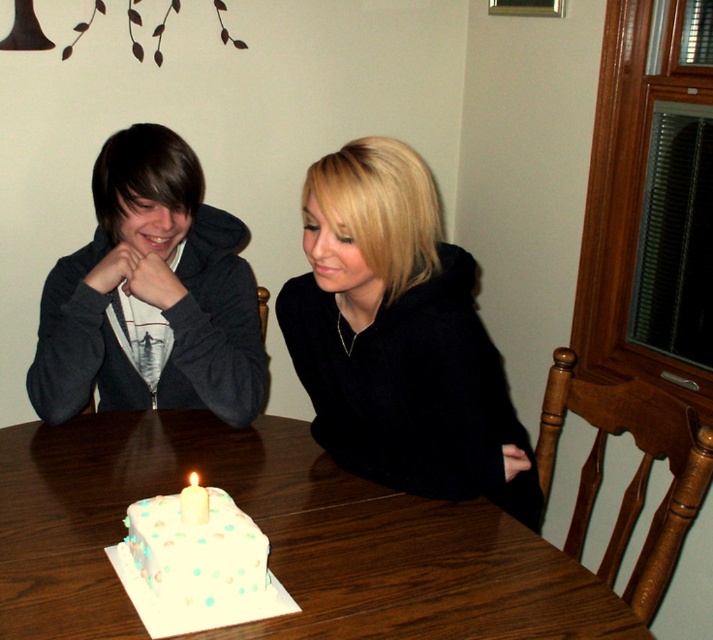
You are standing 1.0 meters away from the dining table. There is a point at coordinates point (31, 602). Can you reach that point without moving your feet?

The distance of point (31, 602) from viewer is 1.07 meters, so you are 0.07 meters too far to reach it without moving your feet.

You are a guest at a birthday celebration and see the white wooden table at center and the white wax candle at center. Which object is positioned higher relative to the other?

The white wax candle at center is positioned higher than the white wooden table at center because it is placed on top of the table.

You are planning to place a rectangular cake on the white wooden table at center. The cake is 1 meter long. Can the cake fit on the table if the black fuzzy sweater at center is already occupying half of the table?

The white wooden table at center is wider than the black fuzzy sweater at center, so the table has enough space to accommodate the cake even if the sweater is occupying half of it. The cake should fit as long as the table length is sufficient. However, the question mentions the cake is 1 meter long, but the table width being larger than the sweater doesn not directly indicate its length. More information about the table length would be needed to confirm.